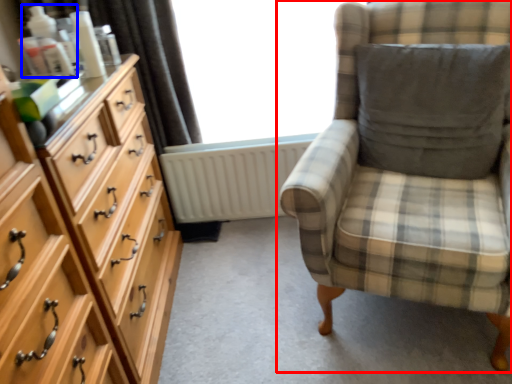
Question: Which of the following is the closest to the observer, chair (highlighted by a red box) or toiletry (highlighted by a blue box)?

Choices:
 (A) chair
 (B) toiletry

Answer: (A)